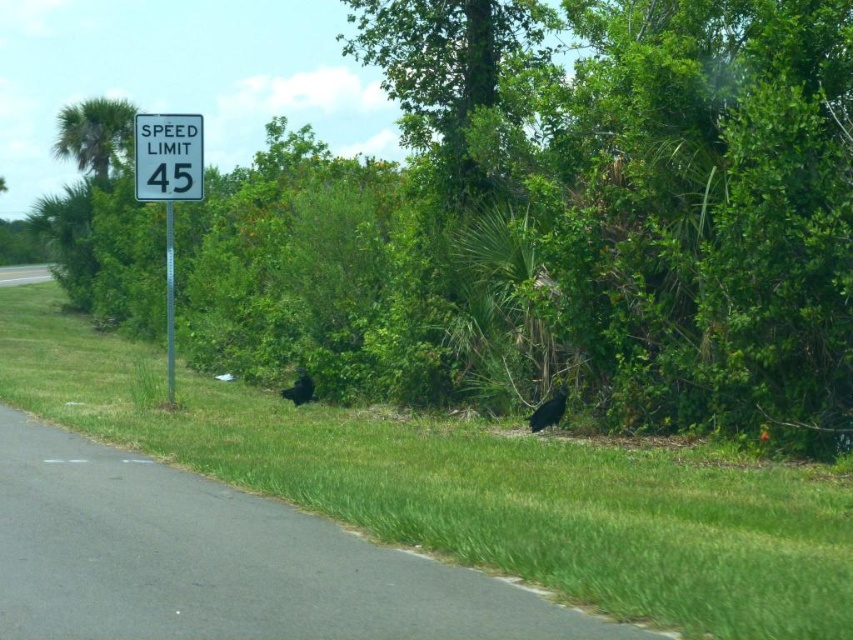
Is green leafy tree at center wider than black feathered bird at center?

Correct, the width of green leafy tree at center exceeds that of black feathered bird at center.

What do you see at coordinates (561, 221) in the screenshot? I see `green leafy tree at center` at bounding box center [561, 221].

You are a GUI agent. You are given a task and a screenshot of the screen. Output one action in this format:
    pyautogui.click(x=<x>, y=<y>)
    Task: Click on the green leafy tree at center
    
    Given the screenshot: What is the action you would take?
    pyautogui.click(x=561, y=221)

In order to click on green leafy tree at center in this screenshot , I will do `click(561, 221)`.

Does green leafy tree at center lie behind white plastic speed limit sign at upper center?

No, it is in front of white plastic speed limit sign at upper center.

Does green leafy tree at center have a lesser width compared to white plastic speed limit sign at upper center?

No.

Looking at this image, who is more forward, [525,321] or [160,186]?

Point [160,186] is in front.

Identify the location of green leafy tree at center. The width and height of the screenshot is (853, 640). (561, 221).

How distant is green leafy tree at center from green leafy tree at upper left?

The distance of green leafy tree at center from green leafy tree at upper left is 17.96 meters.

Does green leafy tree at center have a lesser width compared to green leafy tree at upper left?

In fact, green leafy tree at center might be wider than green leafy tree at upper left.

The width and height of the screenshot is (853, 640). In order to click on green leafy tree at center in this screenshot , I will do `click(561, 221)`.